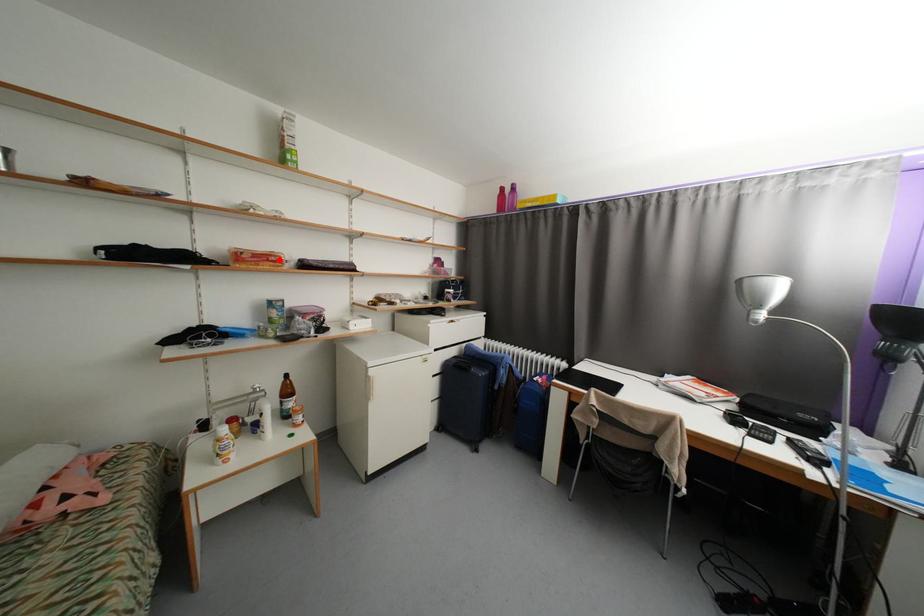
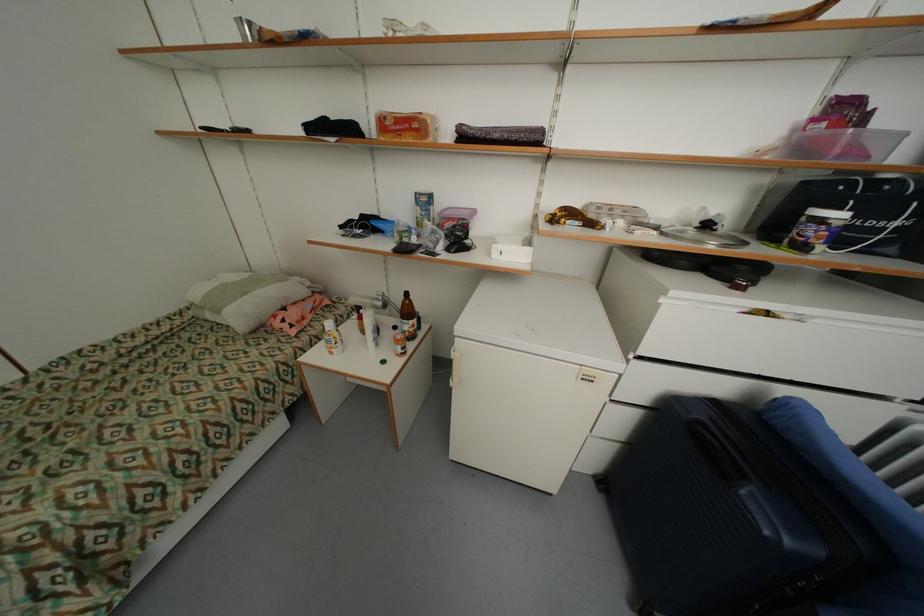
The point at the highlighted location is marked in the first image. Where is the corresponding point in the second image?

(421, 126)